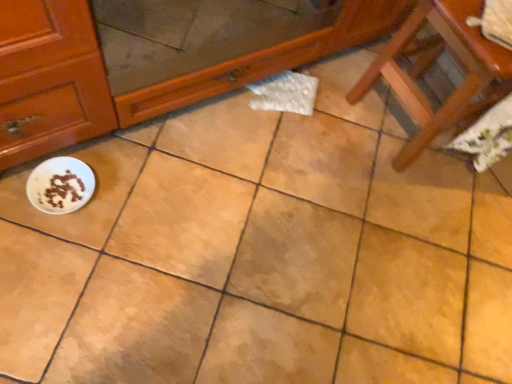
At what (x,y) coordinates should I click in order to perform the action: click on empty space that is to the right of white glossy bowl at lower left. Please return your answer as a coordinate pair (x, y). The width and height of the screenshot is (512, 384). Looking at the image, I should click on (134, 221).